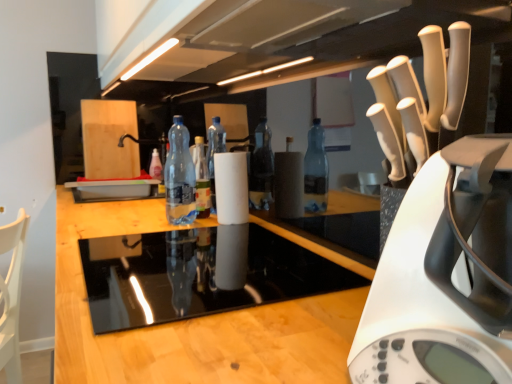
Measure the distance between transparent plastic bottle at center, which is the 1th bottle in right-to-left order, and camera.

transparent plastic bottle at center, which is the 1th bottle in right-to-left order, and camera are 1.29 meters apart.

At what (x,y) coordinates should I click in order to perform the action: click on white plastic kettle at right. Please return your answer as a coordinate pair (x, y). This screenshot has width=512, height=384. Looking at the image, I should click on (444, 275).

Consider the image. Which point is more forward, [185,151] or [493,282]?

The point [493,282] is closer.

Is transparent plastic bottle at center, the 1th bottle when ordered from front to back, taller than white plastic kettle at right?

Correct, transparent plastic bottle at center, the 1th bottle when ordered from front to back, is much taller as white plastic kettle at right.

Would you say transparent plastic bottle at center, the 1th bottle when ordered from front to back, contains white plastic kettle at right?

No, transparent plastic bottle at center, the 1th bottle when ordered from front to back, does not contain white plastic kettle at right.

From a real-world perspective, is transparent plastic bottle at center, arranged as the second bottle when viewed from the left, physically below white plastic kettle at right?

Actually, transparent plastic bottle at center, arranged as the second bottle when viewed from the left, is physically above white plastic kettle at right in the real world.

Does translucent plastic bottle at center, the second bottle when ordered from right to left, turn towards black glass stovetop at center?

No, translucent plastic bottle at center, the second bottle when ordered from right to left, is not aimed at black glass stovetop at center.

From the image's perspective, who appears lower, translucent plastic bottle at center, positioned as the first bottle in back-to-front order, or black glass stovetop at center?

black glass stovetop at center.

Measure the distance from translucent plastic bottle at center, the first bottle viewed from the left, to black glass stovetop at center.

They are 1.25 meters apart.

In terms of size, does translucent plastic bottle at center, the first bottle viewed from the left, appear bigger or smaller than black glass stovetop at center?

Clearly, translucent plastic bottle at center, the first bottle viewed from the left, is smaller in size than black glass stovetop at center.

From the image's perspective, is white plastic kettle at right on transparent plastic bottle at center, arranged as the second bottle when viewed from the left?

Actually, white plastic kettle at right appears below transparent plastic bottle at center, arranged as the second bottle when viewed from the left, in the image.

Is the position of white plastic kettle at right more distant than that of transparent plastic bottle at center, arranged as the second bottle when viewed from the left?

No, white plastic kettle at right is in front of transparent plastic bottle at center, arranged as the second bottle when viewed from the left.

From a real-world perspective, is white plastic kettle at right positioned over transparent plastic bottle at center, the 1th bottle when ordered from front to back, based on gravity?

No, from a real-world perspective, white plastic kettle at right is not on top of transparent plastic bottle at center, the 1th bottle when ordered from front to back.

From their relative heights in the image, would you say white plastic kettle at right is taller or shorter than transparent plastic bottle at center, the 1th bottle when ordered from front to back?

In the image, white plastic kettle at right appears to be shorter than transparent plastic bottle at center, the 1th bottle when ordered from front to back.

Is black glass stovetop at center to the left of white plastic kettle at right from the viewer's perspective?

Correct, you'll find black glass stovetop at center to the left of white plastic kettle at right.

What's the angular difference between black glass stovetop at center and white plastic kettle at right's facing directions?

They differ by 0.417 degrees in their facing directions.

Considering the relative sizes of black glass stovetop at center and white plastic kettle at right in the image provided, is black glass stovetop at center thinner than white plastic kettle at right?

No.

The image size is (512, 384). Find the location of `countertop on the left side of white plastic kettle at right`. countertop on the left side of white plastic kettle at right is located at coordinates (190, 321).

Considering the positions of objects white plastic kettle at right and translucent plastic bottle at center, positioned as the first bottle in back-to-front order, in the image provided, who is behind, white plastic kettle at right or translucent plastic bottle at center, positioned as the first bottle in back-to-front order,?

translucent plastic bottle at center, positioned as the first bottle in back-to-front order, is behind.

Which point is more forward, (464,223) or (152,163)?

The point (464,223) is closer.

From the image's perspective, who appears lower, white plastic kettle at right or translucent plastic bottle at center, positioned as the first bottle in back-to-front order?

white plastic kettle at right is shown below in the image.

From a real-world perspective, between white plastic kettle at right and translucent plastic bottle at center, which ranks as the 2th bottle in front-to-back order, who is vertically lower?

translucent plastic bottle at center, which ranks as the 2th bottle in front-to-back order, is physically lower.

Measure the distance from transparent plastic bottle at center, arranged as the second bottle when viewed from the left, to translucent plastic bottle at center, the second bottle when ordered from right to left.

transparent plastic bottle at center, arranged as the second bottle when viewed from the left, and translucent plastic bottle at center, the second bottle when ordered from right to left, are 29.04 inches apart.

In terms of width, does transparent plastic bottle at center, which is the 1th bottle in right-to-left order, look wider or thinner when compared to translucent plastic bottle at center, the first bottle viewed from the left?

In the image, transparent plastic bottle at center, which is the 1th bottle in right-to-left order, appears to be wider than translucent plastic bottle at center, the first bottle viewed from the left.

Would you consider transparent plastic bottle at center, which is counted as the second bottle, starting from the back, to be distant from translucent plastic bottle at center, which ranks as the 2th bottle in front-to-back order?

Actually, transparent plastic bottle at center, which is counted as the second bottle, starting from the back, and translucent plastic bottle at center, which ranks as the 2th bottle in front-to-back order, are a little close together.

Considering the points (192, 171) and (158, 160), which point is in front, point (192, 171) or point (158, 160)?

The point (192, 171) is more forward.

Considering the sizes of translucent plastic bottle at center, positioned as the first bottle in back-to-front order, and transparent plastic bottle at center, which is counted as the second bottle, starting from the back, in the image, is translucent plastic bottle at center, positioned as the first bottle in back-to-front order, taller or shorter than transparent plastic bottle at center, which is counted as the second bottle, starting from the back,?

In the image, translucent plastic bottle at center, positioned as the first bottle in back-to-front order, appears to be shorter than transparent plastic bottle at center, which is counted as the second bottle, starting from the back.

From a real-world perspective, is translucent plastic bottle at center, the second bottle when ordered from right to left, physically located above or below transparent plastic bottle at center, which is the 1th bottle in right-to-left order?

From a real-world perspective, translucent plastic bottle at center, the second bottle when ordered from right to left, is physically below transparent plastic bottle at center, which is the 1th bottle in right-to-left order.

Which object is wider, translucent plastic bottle at center, the first bottle viewed from the left, or transparent plastic bottle at center, arranged as the second bottle when viewed from the left?

transparent plastic bottle at center, arranged as the second bottle when viewed from the left, is wider.

Is translucent plastic bottle at center, the second bottle when ordered from right to left, not inside transparent plastic bottle at center, which is the 1th bottle in right-to-left order?

Yes, translucent plastic bottle at center, the second bottle when ordered from right to left, is outside of transparent plastic bottle at center, which is the 1th bottle in right-to-left order.

The height and width of the screenshot is (384, 512). What are the coordinates of `home appliance below the transparent plastic bottle at center, which is the 1th bottle in right-to-left order (from the image's perspective)` in the screenshot? It's located at (444, 275).

From the image's perspective, which bottle is the 2nd one above the black glass stovetop at center? Please provide its 2D coordinates.

[(155, 166)]

Estimate the real-world distances between objects in this image. Which object is further from black glass stovetop at center, translucent plastic bottle at center, positioned as the first bottle in back-to-front order, or white plastic kettle at right?

Among the two, translucent plastic bottle at center, positioned as the first bottle in back-to-front order, is located further to black glass stovetop at center.

Looking at the image, which one is located closer to black glass stovetop at center, white plastic kettle at right or transparent plastic bottle at center, the 1th bottle when ordered from front to back?

Among the two, white plastic kettle at right is located nearer to black glass stovetop at center.

When comparing their distances from transparent plastic bottle at center, arranged as the second bottle when viewed from the left, does black glass stovetop at center or white plastic kettle at right seem closer?

black glass stovetop at center.

Considering their positions, is transparent plastic bottle at center, arranged as the second bottle when viewed from the left, positioned further to white plastic kettle at right than black glass stovetop at center?

transparent plastic bottle at center, arranged as the second bottle when viewed from the left, is positioned further to the anchor white plastic kettle at right.

Estimate the real-world distances between objects in this image. Which object is closer to transparent plastic bottle at center, which is the 1th bottle in right-to-left order, translucent plastic bottle at center, the second bottle when ordered from right to left, or black glass stovetop at center?

The object closer to transparent plastic bottle at center, which is the 1th bottle in right-to-left order, is black glass stovetop at center.

Estimate the real-world distances between objects in this image. Which object is further from translucent plastic bottle at center, which ranks as the 2th bottle in front-to-back order, transparent plastic bottle at center, arranged as the second bottle when viewed from the left, or black glass stovetop at center?

black glass stovetop at center is positioned further to the anchor translucent plastic bottle at center, which ranks as the 2th bottle in front-to-back order.

Considering their positions, is translucent plastic bottle at center, the first bottle viewed from the left, positioned further to transparent plastic bottle at center, the 1th bottle when ordered from front to back, than white plastic kettle at right?

white plastic kettle at right.

In the scene shown: Looking at the image, which one is located further to transparent plastic bottle at center, arranged as the second bottle when viewed from the left, white plastic kettle at right or translucent plastic bottle at center, the second bottle when ordered from right to left?

white plastic kettle at right is further to transparent plastic bottle at center, arranged as the second bottle when viewed from the left.

At what (x,y) coordinates should I click in order to perform the action: click on countertop between white plastic kettle at right and transparent plastic bottle at center, which is counted as the second bottle, starting from the back, in the front-back direction. Please return your answer as a coordinate pair (x, y). This screenshot has width=512, height=384. Looking at the image, I should click on (190, 321).

The height and width of the screenshot is (384, 512). Identify the location of bottle between black glass stovetop at center and translucent plastic bottle at center, positioned as the first bottle in back-to-front order, in the front-back direction. (179, 176).

Where is `bottle positioned between white plastic kettle at right and translucent plastic bottle at center, positioned as the first bottle in back-to-front order, from near to far`? This screenshot has height=384, width=512. bottle positioned between white plastic kettle at right and translucent plastic bottle at center, positioned as the first bottle in back-to-front order, from near to far is located at coordinates (179, 176).

Image resolution: width=512 pixels, height=384 pixels. Find the location of `countertop between white plastic kettle at right and translucent plastic bottle at center, the first bottle viewed from the left, from front to back`. countertop between white plastic kettle at right and translucent plastic bottle at center, the first bottle viewed from the left, from front to back is located at coordinates (190, 321).